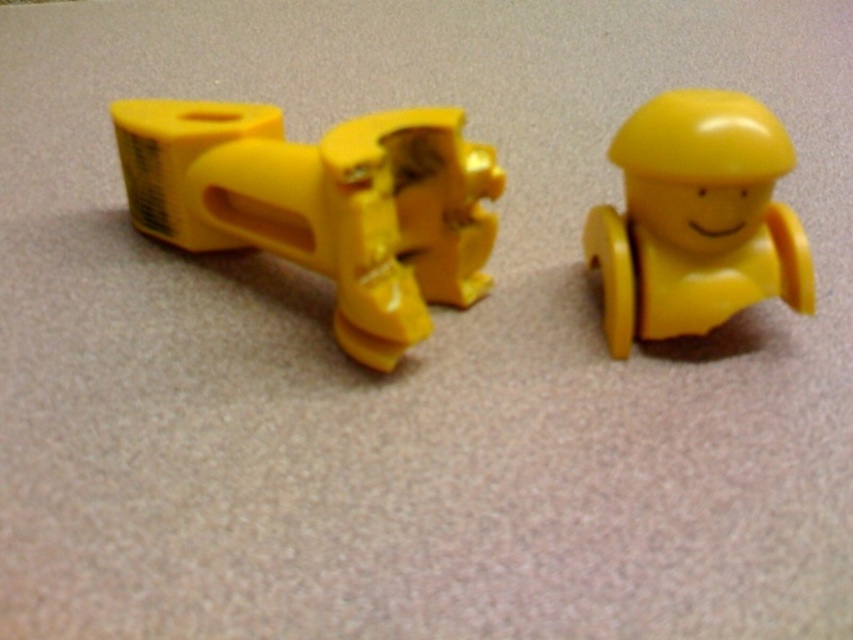
You are standing in a room with two yellow plastic objects on a beige carpet. You see a larger object on the left and a point marked at coordinates (323, 204). What object is located at that point?

The point at coordinates (323, 204) corresponds to the matte yellow toy at left.

You have two yellow matte toys in front of you. The matte yellow toy at left and the yellow matte toy at right. Which one is wider?

The matte yellow toy at left is wider than the yellow matte toy at right according to the description.